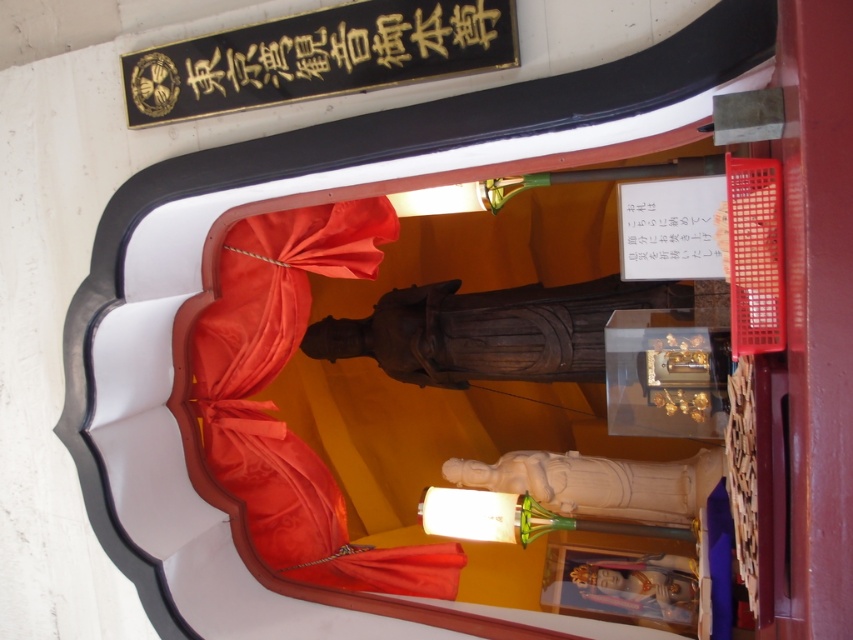
Question: Among these objects, which one is nearest to the camera?

Choices:
 (A) matte red fabric at center
 (B) goldmaterial/texturesign at upper center

Answer: (B)

Question: Which of the following is the farthest from the observer?

Choices:
 (A) (361, 269)
 (B) (221, 65)

Answer: (A)

Question: Does matte red fabric at center have a greater width compared to goldmaterial/texturesign at upper center?

Choices:
 (A) yes
 (B) no

Answer: (A)

Question: Does matte red fabric at center have a lesser width compared to goldmaterial/texturesign at upper center?

Choices:
 (A) no
 (B) yes

Answer: (A)

Question: Can you confirm if matte red fabric at center is wider than goldmaterial/texturesign at upper center?

Choices:
 (A) no
 (B) yes

Answer: (B)

Question: Among these objects, which one is farthest from the camera?

Choices:
 (A) matte red fabric at center
 (B) goldmaterial/texturesign at upper center

Answer: (A)